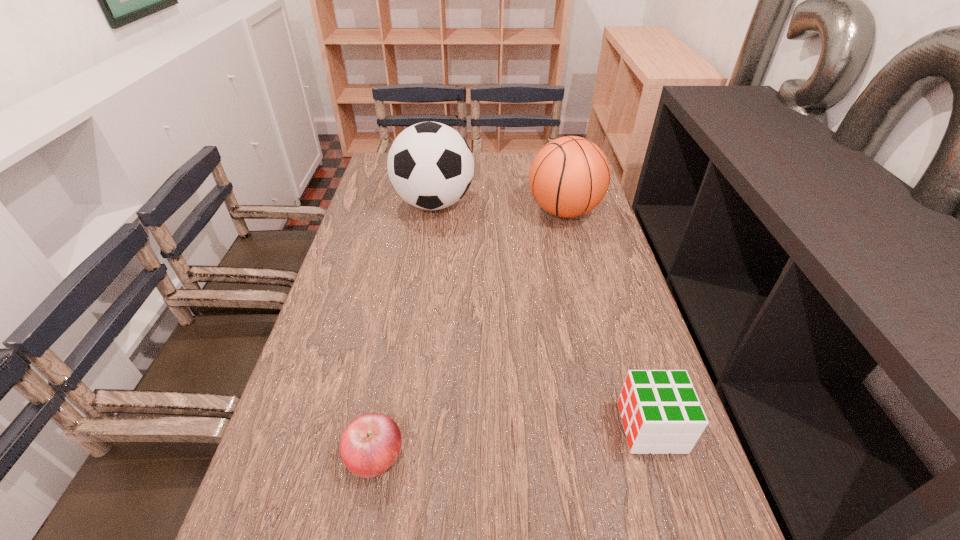
You are a GUI agent. You are given a task and a screenshot of the screen. Output one action in this format:
    pyautogui.click(x=<x>, y=<y>)
    Task: Click on the vacant area in the image that satisfies the following two spatial constraints: 1. on the back side of the apple; 2. on the right side of the soccer ball
    
    Given the screenshot: What is the action you would take?
    pyautogui.click(x=420, y=204)

This screenshot has height=540, width=960. In order to click on vacant area that satisfies the following two spatial constraints: 1. on the back side of the soccer ball; 2. on the right side of the apple in this screenshot , I will do `click(420, 204)`.

Image resolution: width=960 pixels, height=540 pixels. In order to click on free location that satisfies the following two spatial constraints: 1. on the front side of the basketball; 2. on the left side of the soccer ball in this screenshot , I will do `click(433, 211)`.

Where is `free spot that satisfies the following two spatial constraints: 1. on the front side of the basketball; 2. on the left side of the soccer ball`? This screenshot has width=960, height=540. free spot that satisfies the following two spatial constraints: 1. on the front side of the basketball; 2. on the left side of the soccer ball is located at coordinates (433, 211).